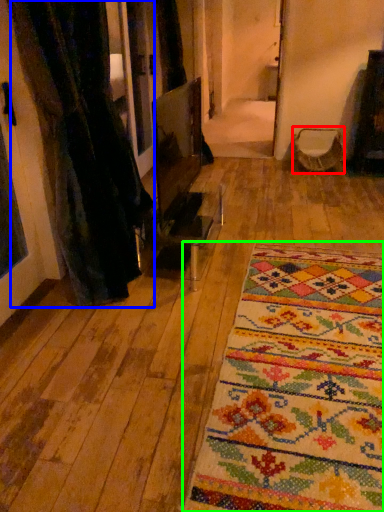
Question: Which object is the closest to the armchair (highlighted by a red box)? Choose among these: curtain (highlighted by a blue box) or mat (highlighted by a green box).

Choices:
 (A) curtain
 (B) mat

Answer: (A)